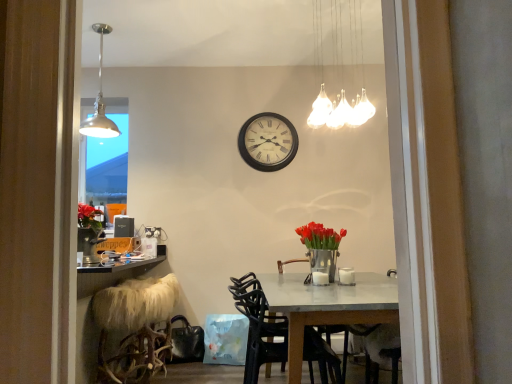
Question: Can you confirm if metallic pendant light at upper left, which appears as the 2th lamp when viewed from the right, is shorter than wooden wall clock at center?

Choices:
 (A) no
 (B) yes

Answer: (A)

Question: Are metallic pendant light at upper left, which appears as the 2th lamp when viewed from the right, and wooden wall clock at center located far from each other?

Choices:
 (A) yes
 (B) no

Answer: (A)

Question: Is metallic pendant light at upper left, marked as the 2th lamp in a front-to-back arrangement, positioned before wooden wall clock at center?

Choices:
 (A) no
 (B) yes

Answer: (B)

Question: Is metallic pendant light at upper left, the first lamp from the left, directly adjacent to wooden wall clock at center?

Choices:
 (A) yes
 (B) no

Answer: (B)

Question: Can you confirm if metallic pendant light at upper left, the first lamp from the left, is bigger than wooden wall clock at center?

Choices:
 (A) no
 (B) yes

Answer: (B)

Question: Is metallic pendant light at upper left, which appears as the 2th lamp when viewed from the right, at the right side of wooden wall clock at center?

Choices:
 (A) yes
 (B) no

Answer: (B)

Question: Would you say fuzzy white stool at lower left is outside black plastic chair at center?

Choices:
 (A) no
 (B) yes

Answer: (B)

Question: Is fuzzy white stool at lower left smaller than black plastic chair at center?

Choices:
 (A) no
 (B) yes

Answer: (B)

Question: Is fuzzy white stool at lower left to the left of black plastic chair at center from the viewer's perspective?

Choices:
 (A) no
 (B) yes

Answer: (B)

Question: Considering the relative sizes of fuzzy white stool at lower left and black plastic chair at center in the image provided, is fuzzy white stool at lower left shorter than black plastic chair at center?

Choices:
 (A) yes
 (B) no

Answer: (B)

Question: Are fuzzy white stool at lower left and black plastic chair at center far apart?

Choices:
 (A) no
 (B) yes

Answer: (A)

Question: Could you tell me if fuzzy white stool at lower left is facing black plastic chair at center?

Choices:
 (A) no
 (B) yes

Answer: (A)

Question: From the image's perspective, is metallic vase with red tulips at center below fuzzy white stool at lower left?

Choices:
 (A) yes
 (B) no

Answer: (B)